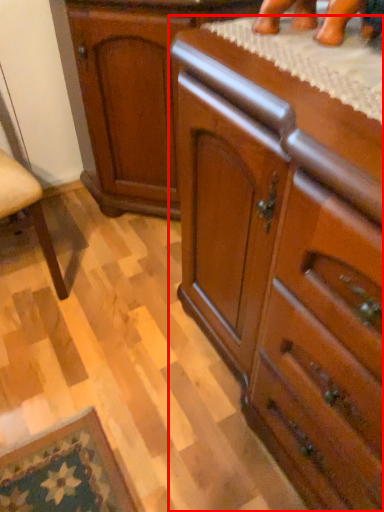
Question: From the image's perspective, where is chest of drawers (annotated by the red box) located relative to cabinetry?

Choices:
 (A) below
 (B) above

Answer: (A)